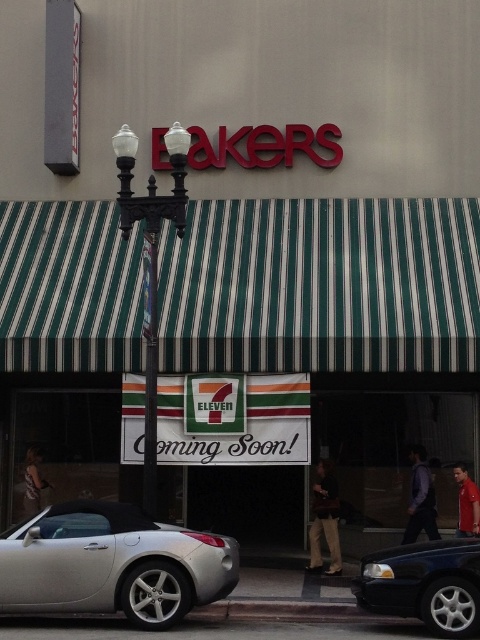
Is silver metallic convertible at lower left bigger than metallic streetlamp at center?

Yes.

Is silver metallic convertible at lower left further to the viewer compared to metallic streetlamp at center?

No.

Between point (178, 616) and point (155, 275), which one is positioned behind?

Point (155, 275)

At what (x,y) coordinates should I click in order to perform the action: click on silver metallic convertible at lower left. Please return your answer as a coordinate pair (x, y). Looking at the image, I should click on (112, 564).

Can you confirm if shiny black sedan at lower right is positioned to the right of metallic streetlamp at center?

Yes, shiny black sedan at lower right is to the right of metallic streetlamp at center.

Can you confirm if shiny black sedan at lower right is positioned to the left of metallic streetlamp at center?

No, shiny black sedan at lower right is not to the left of metallic streetlamp at center.

Locate an element on the screen. The image size is (480, 640). shiny black sedan at lower right is located at coordinates (424, 584).

Find the location of `shiny black sedan at lower right`. shiny black sedan at lower right is located at coordinates (424, 584).

In the scene shown: Does silver metallic convertible at lower left have a larger size compared to shiny black sedan at lower right?

Correct, silver metallic convertible at lower left is larger in size than shiny black sedan at lower right.

Does silver metallic convertible at lower left have a smaller size compared to shiny black sedan at lower right?

Actually, silver metallic convertible at lower left might be larger than shiny black sedan at lower right.

Where is `silver metallic convertible at lower left`? silver metallic convertible at lower left is located at coordinates (112, 564).